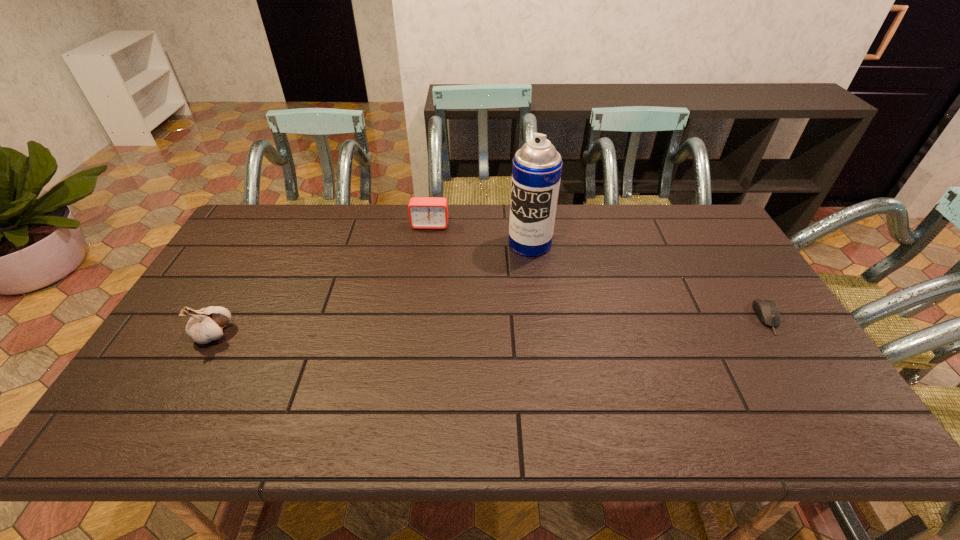
Find the location of a particular element. The height and width of the screenshot is (540, 960). vacant space on the desktop that is between the leftmost object and the rightmost object and is positioned on the label side of the third object from left to right is located at coordinates (468, 327).

The width and height of the screenshot is (960, 540). I want to click on free spot on the desktop that is between the leftmost object and the shortest object and is positioned on the front-facing side of the third object from right to left, so click(x=413, y=328).